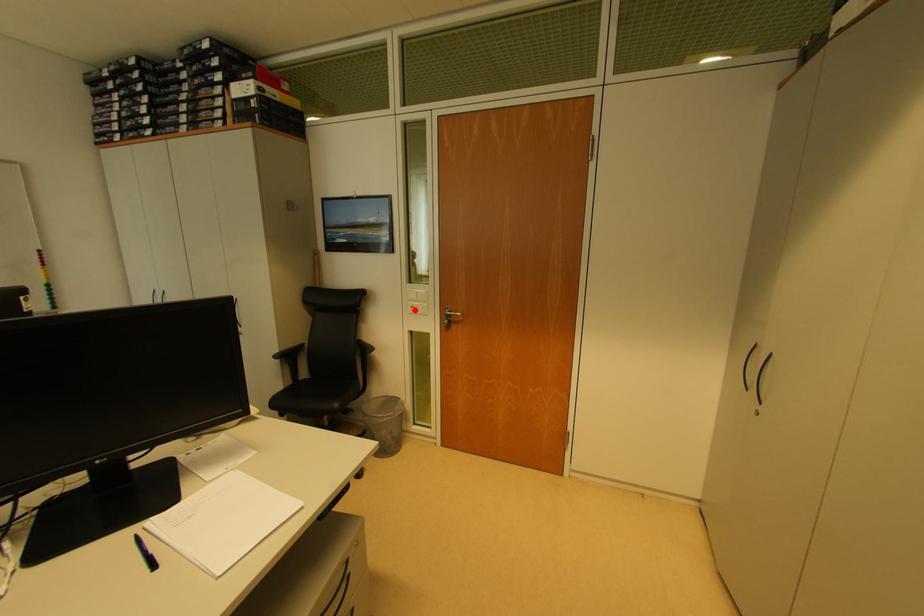
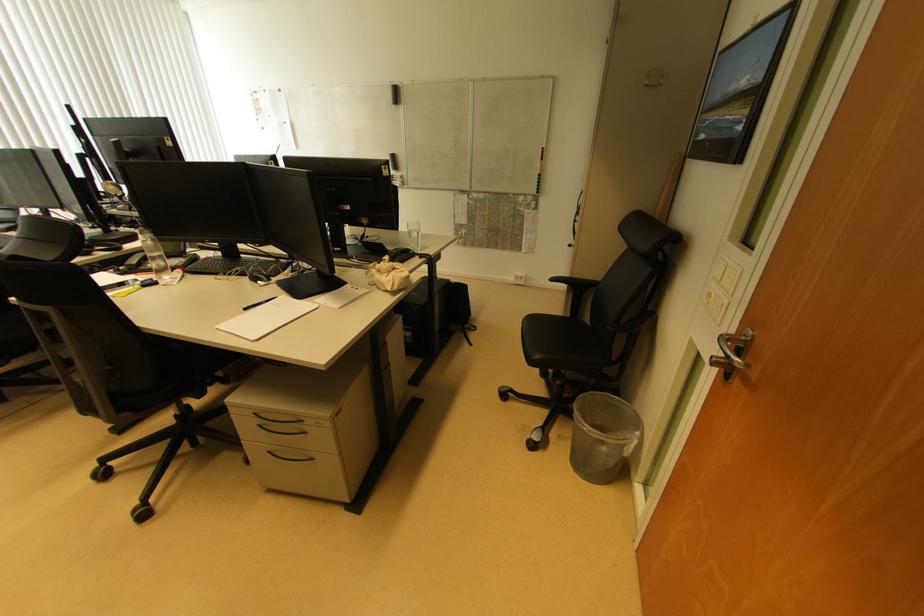
Where in the second image is the point corresponding to the highlighted location from the first image?

(712, 297)